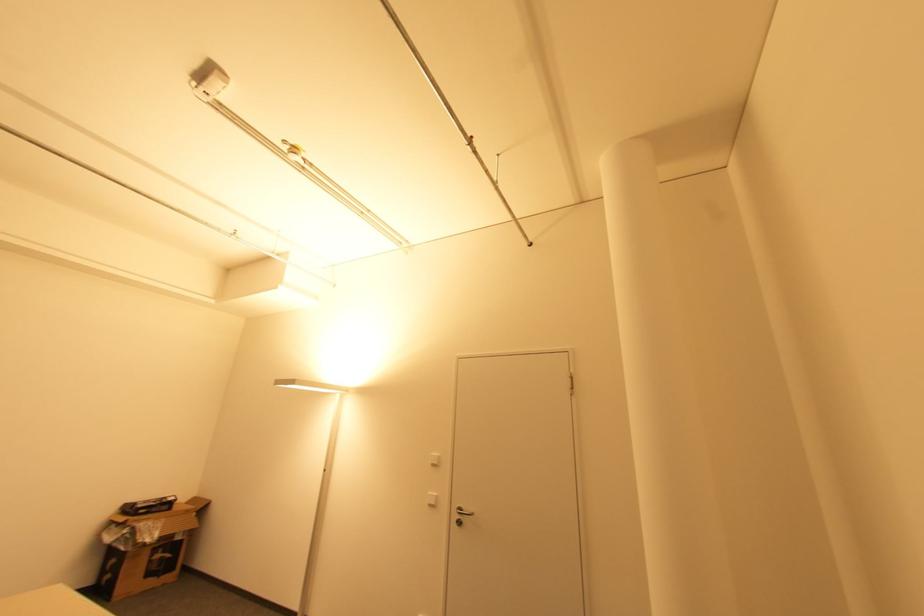
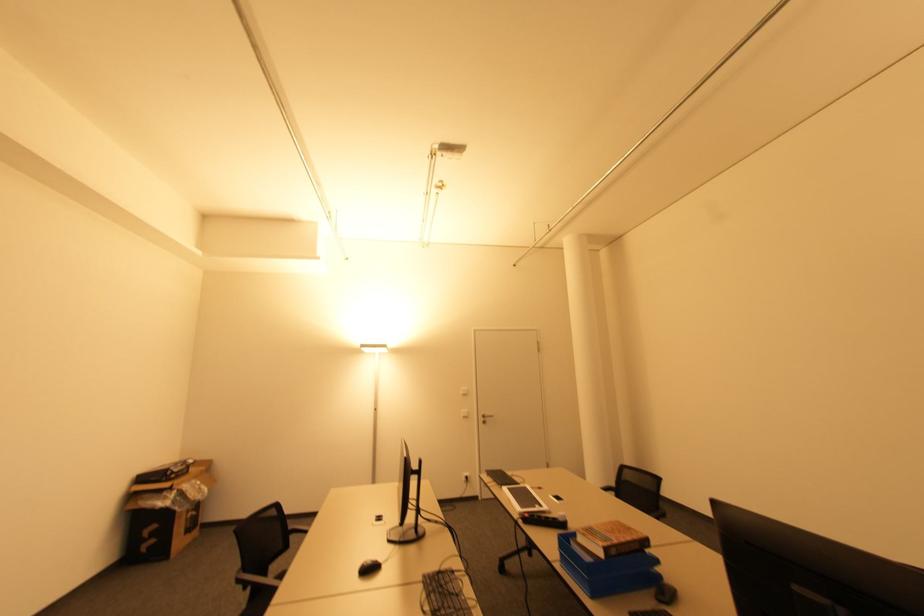
Find the pixel in the second image that matches point 433,506 in the first image.

(467, 416)